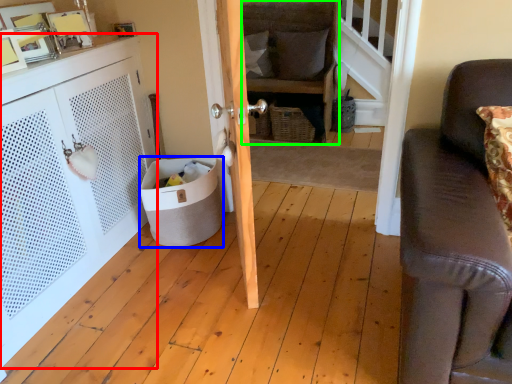
Question: Based on their relative distances, which object is farther from cabinetry (highlighted by a red box)? Choose from trash bin/can (highlighted by a blue box) and chair (highlighted by a green box).

Choices:
 (A) trash bin/can
 (B) chair

Answer: (B)